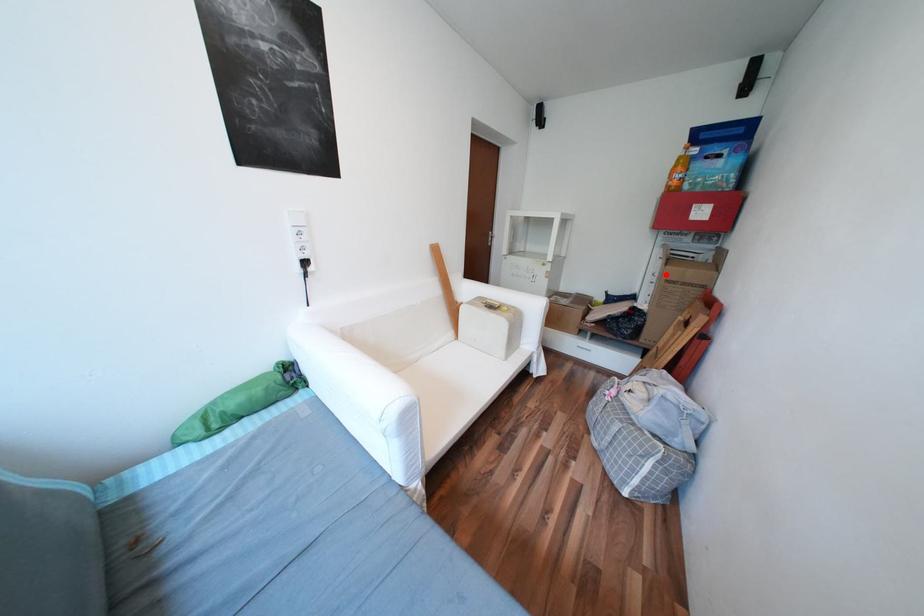
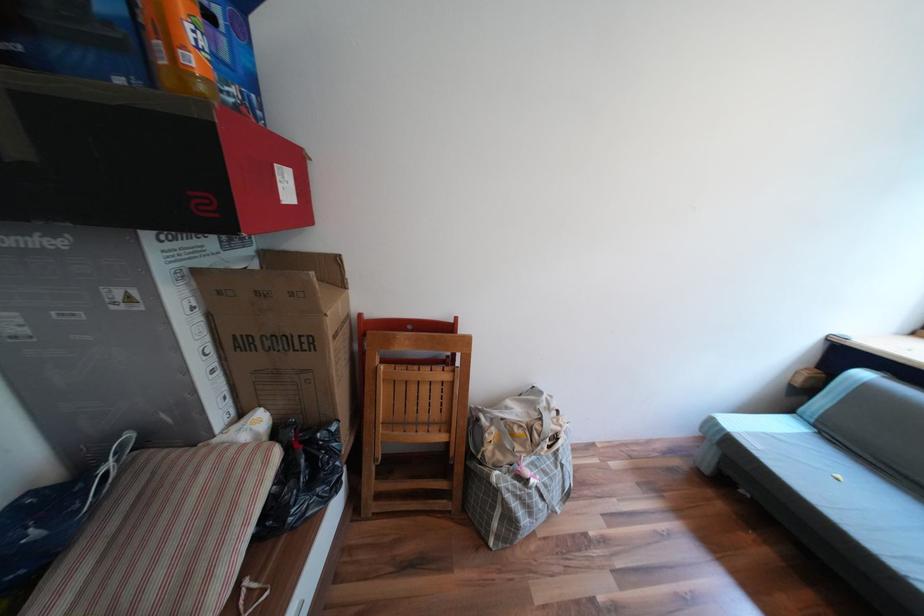
Question: I am providing you with two images of the same scene from different viewpoints. Given a red point in image1, look at the same physical point in image2. Is it:

Choices:
 (A) Closer to the viewpoint
 (B) Farther from the viewpoint

Answer: (B)